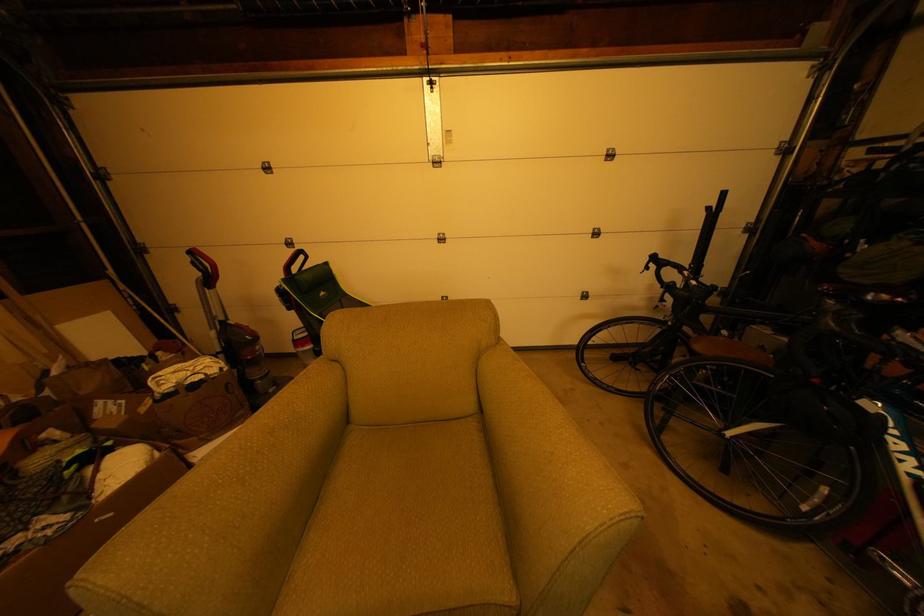
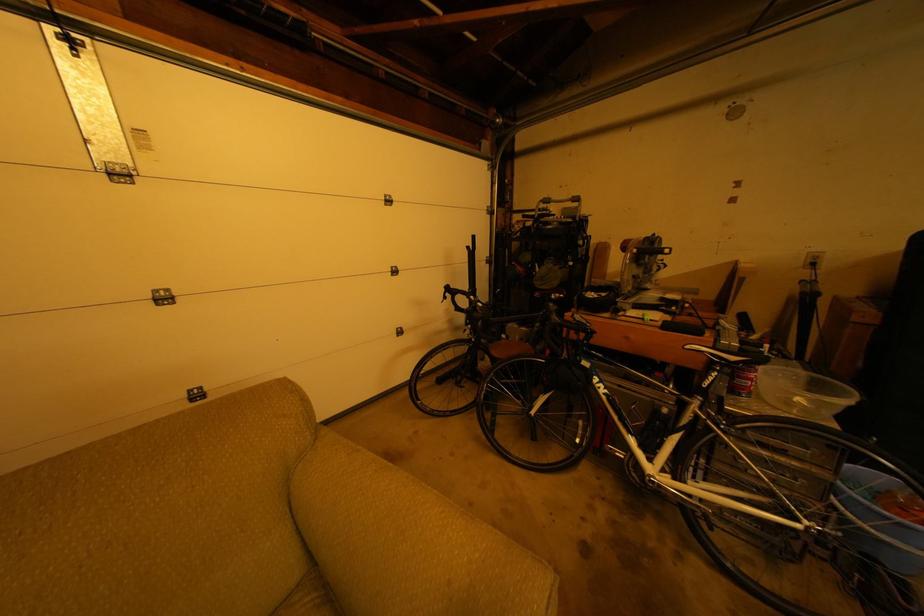
Question: How did the camera likely rotate?

Choices:
 (A) Left
 (B) Right
 (C) Up
 (D) Down

Answer: (B)